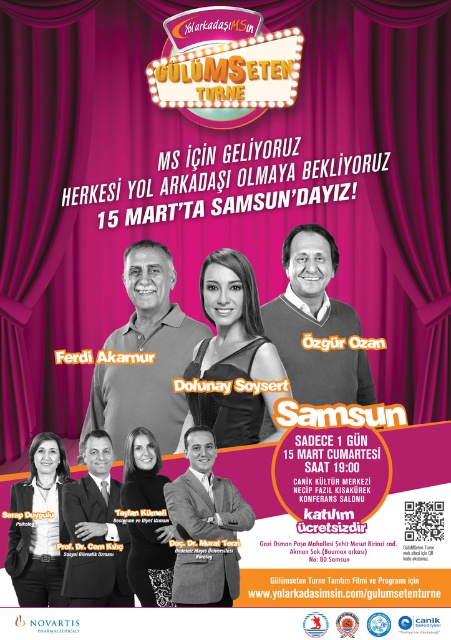
You are attending the event and see the promotional poster. You want to know which item is placed higher on the poster between the matte black sweater at center and the dark brown suit at center. Which one is higher?

The matte black sweater at center is above the dark brown suit at center, so the matte black sweater at center is placed higher on the poster.

Looking at this image, you are standing at the entrance of the event venue and see the promotional poster with the matte black sweater at center and the dark brown suit at center. If you want to move from the entrance to the poster, which object would you reach first?

The matte black sweater at center and the dark brown suit at center are both at the center of the poster, so you would reach them at the same time. However, since the matte black sweater at center is 3.57 meters away from the dark brown suit at center, you would first encounter the one closer to the entrance, but the description does not specify their positions relative to the entrance.

You are organizing a charity event for Multiple Sclerosis awareness and need to choose an outfit that is taller between the matte black sweater at center and the black textured dress at center. Which one should you pick?

The matte black sweater at center has a greater height compared to the black textured dress at center, so you should pick the matte black sweater at center.